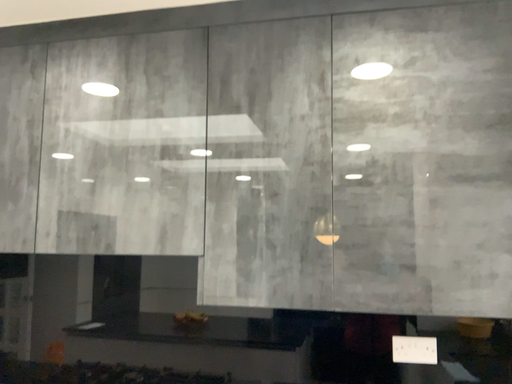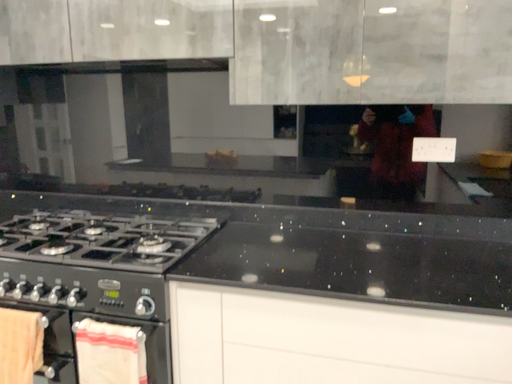
Question: How did the camera likely rotate when shooting the video?

Choices:
 (A) rotated upward
 (B) rotated downward

Answer: (B)